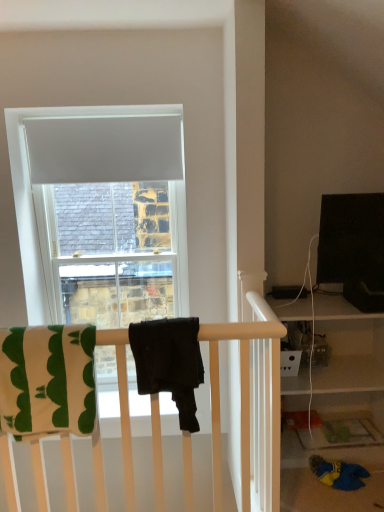
Question: Is white matte curtain at upper center bigger or smaller than green cotton beach towel at left, the second beach towel when ordered from right to left?

Choices:
 (A) small
 (B) big

Answer: (A)

Question: In the image, is white matte curtain at upper center positioned in front of or behind green cotton beach towel at left, the second beach towel when ordered from right to left?

Choices:
 (A) behind
 (B) front

Answer: (A)

Question: Which object is positioned closest to the green cotton beach towel at left, placed as the first beach towel when sorted from left to right?

Choices:
 (A) black matte towel at center, the 1th beach towel in the right-to-left sequence
 (B) white matte curtain at upper center

Answer: (A)

Question: Considering the real-world distances, which object is closest to the white matte curtain at upper center?

Choices:
 (A) black matte towel at center, the 1th beach towel in the right-to-left sequence
 (B) green cotton beach towel at left, the second beach towel when ordered from right to left

Answer: (B)